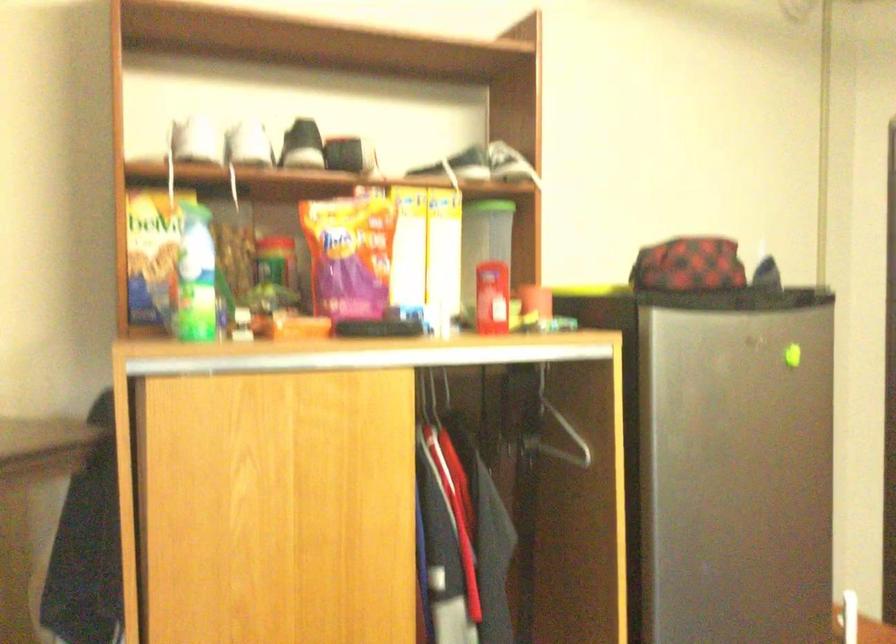
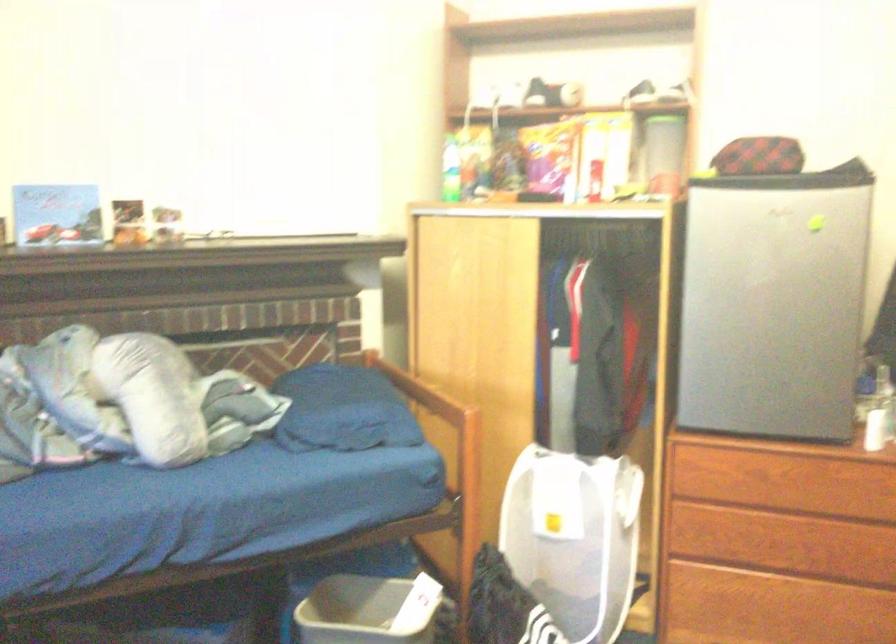
The point at [337,574] is marked in the first image. Where is the corresponding point in the second image?

(502, 323)